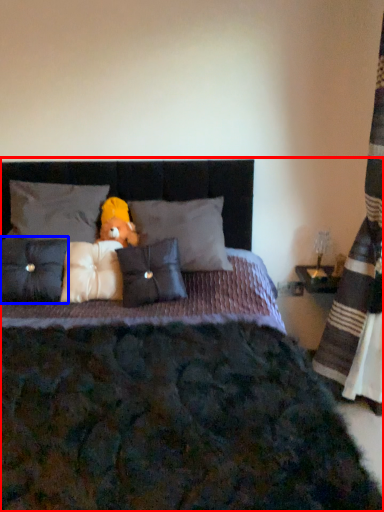
Question: Among these objects, which one is farthest to the camera, bed (highlighted by a red box) or pillow (highlighted by a blue box)?

Choices:
 (A) bed
 (B) pillow

Answer: (B)